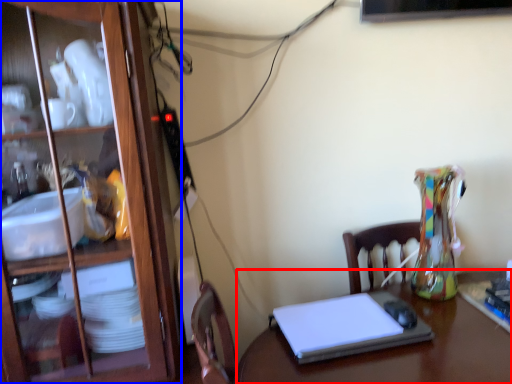
Question: Which of the following is the closest to the observer, desk (highlighted by a red box) or cabinetry (highlighted by a blue box)?

Choices:
 (A) desk
 (B) cabinetry

Answer: (A)